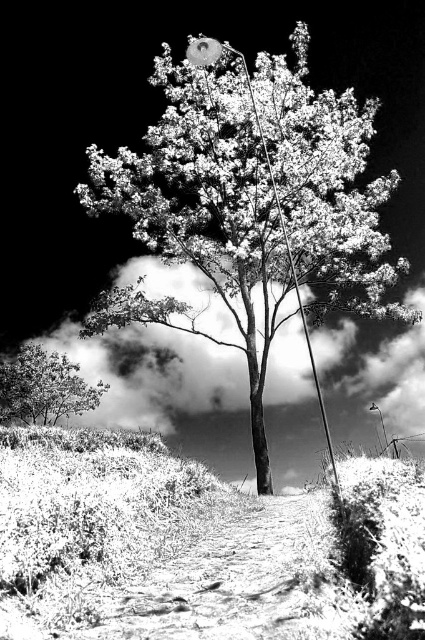
Does smooth bark tree at center appear on the right side of smooth green tree at lower left?

Yes, smooth bark tree at center is to the right of smooth green tree at lower left.

Which is behind, point (201, 42) or point (11, 364)?

Point (11, 364)

Find the location of a particular element. smooth bark tree at center is located at coordinates (251, 204).